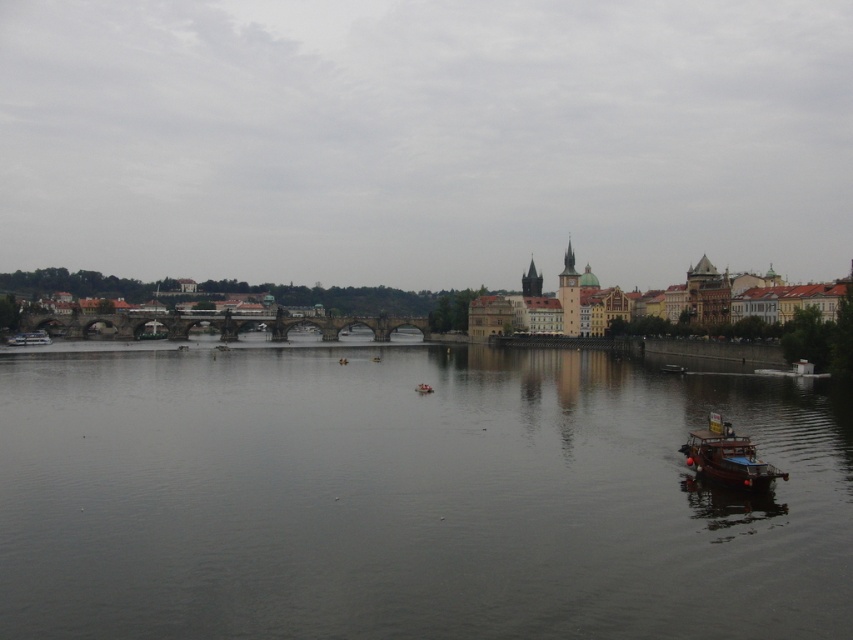
Question: Can you confirm if wooden boat at lower right is smaller than wooden boat at left?

Choices:
 (A) yes
 (B) no

Answer: (B)

Question: Estimate the real-world distances between objects in this image. Which object is closer to the wooden boat at left?

Choices:
 (A) wooden boat at lower right
 (B) dark gray water at center

Answer: (B)

Question: Which object is closer to the camera taking this photo?

Choices:
 (A) wooden boat at left
 (B) dark gray water at center

Answer: (B)

Question: Can you confirm if wooden boat at lower right is thinner than wooden boat at left?

Choices:
 (A) yes
 (B) no

Answer: (A)

Question: Can you confirm if dark gray water at center is wider than wooden boat at lower right?

Choices:
 (A) yes
 (B) no

Answer: (A)

Question: Which of the following is the farthest from the observer?

Choices:
 (A) (28, 408)
 (B) (39, 332)

Answer: (B)